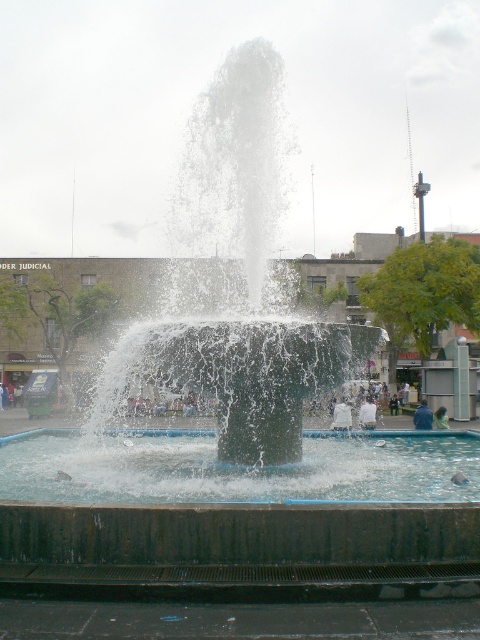
From the picture: Is white fabric shirt at center further to camera compared to blue denim jacket at center?

That is False.

Is white fabric shirt at center bigger than blue denim jacket at center?

Yes.

Find the location of a particular element. white fabric shirt at center is located at coordinates (342, 416).

Is clear water at center wider than white fabric shirt at center?

Correct, the width of clear water at center exceeds that of white fabric shirt at center.

Between point (403, 432) and point (340, 410), which one is positioned in front?

Positioned in front is point (403, 432).

Between point (132, 444) and point (346, 419), which one is positioned in front?

Point (132, 444) is more forward.

At what (x,y) coordinates should I click in order to perform the action: click on clear water at center. Please return your answer as a coordinate pair (x, y). Looking at the image, I should click on (238, 467).

Does point (37, 444) come in front of point (442, 406)?

Yes, it is in front of point (442, 406).

Between point (48, 444) and point (434, 417), which one is positioned behind?

Point (434, 417)

Where is `clear water at center`? clear water at center is located at coordinates (238, 467).